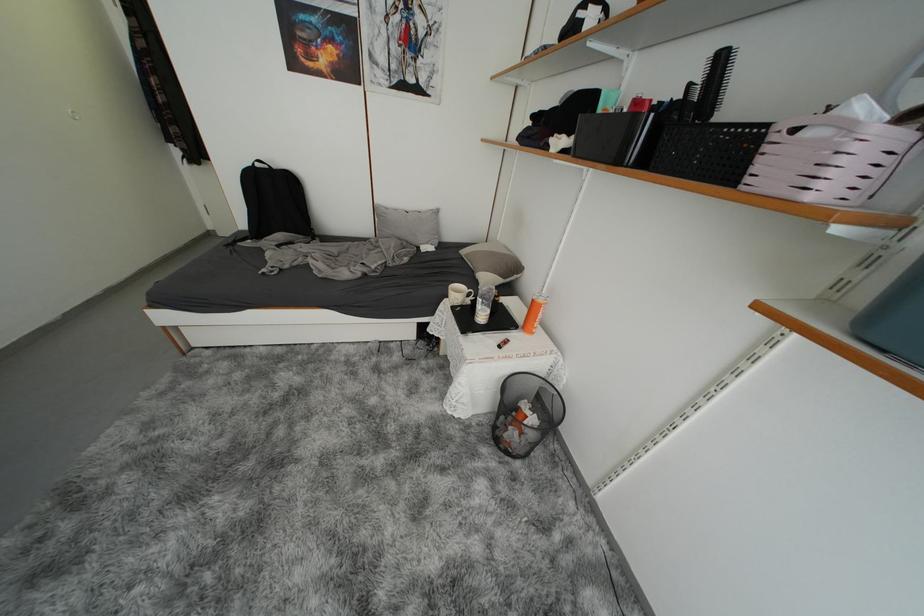
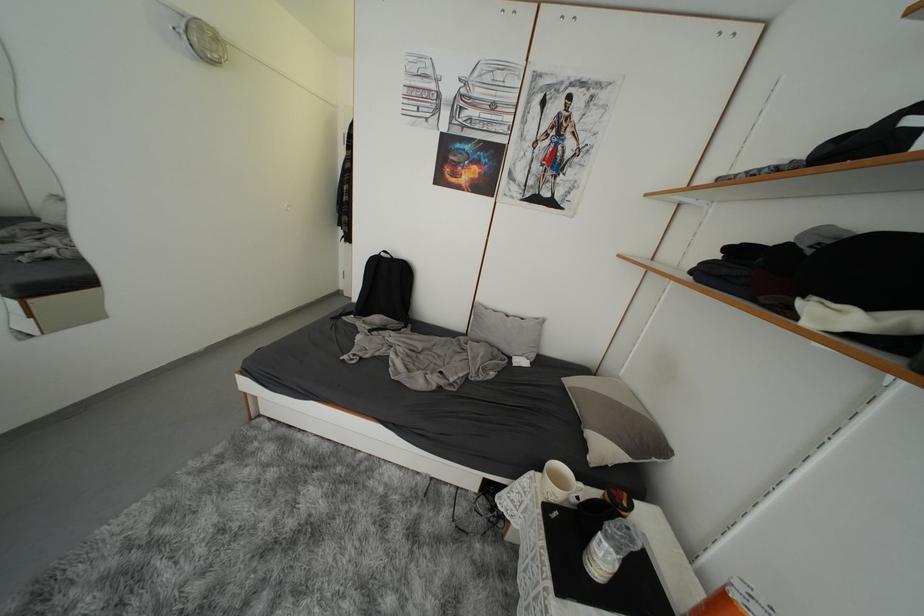
Locate, in the second image, the point that corresponds to point 264,169 in the first image.

(390, 257)